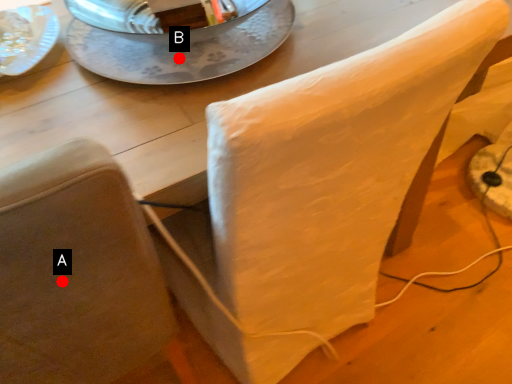
Question: Two points are circled on the image, labeled by A and B beside each circle. Which point appears farthest from the camera in this image?

Choices:
 (A) A is further
 (B) B is further

Answer: (B)